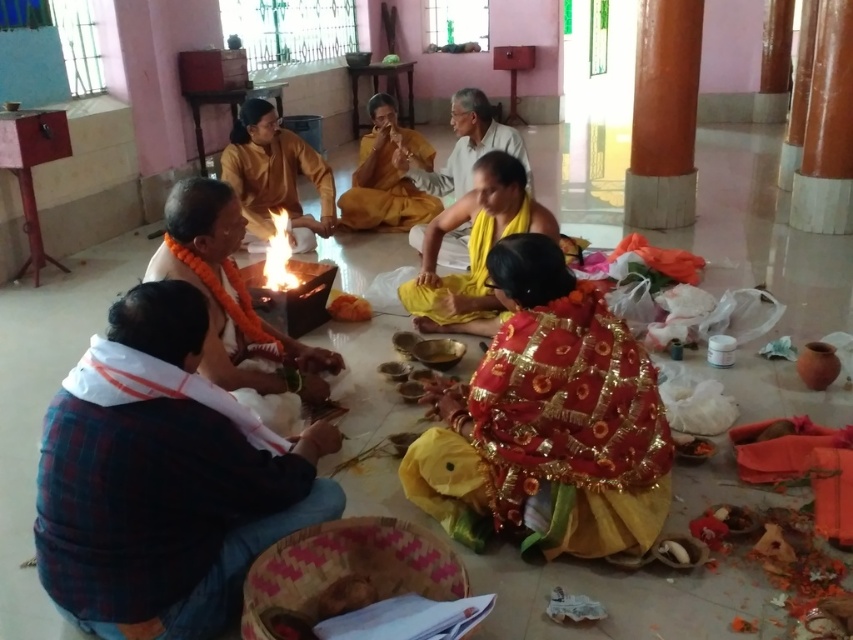
Question: Among these points, which one is nearest to the camera?

Choices:
 (A) (457, 106)
 (B) (276, 189)

Answer: (A)

Question: Is yellow silk saree at center to the left of yellow cloth at center from the viewer's perspective?

Choices:
 (A) no
 (B) yes

Answer: (A)

Question: Which object is closer to the camera taking this photo?

Choices:
 (A) red sequined saree at center
 (B) yellow clothed monk at center
 (C) matte black pot at center
 (D) plaid fabric shirt at lower left

Answer: (D)

Question: Can you confirm if red sequined saree at center is positioned to the right of yellow clothed monk at center?

Choices:
 (A) yes
 (B) no

Answer: (A)

Question: Is matte black pot at center above yellow silk saree at center?

Choices:
 (A) no
 (B) yes

Answer: (A)

Question: Which object appears closest to the camera in this image?

Choices:
 (A) plaid fabric shirt at lower left
 (B) yellow clothed monk at center

Answer: (A)